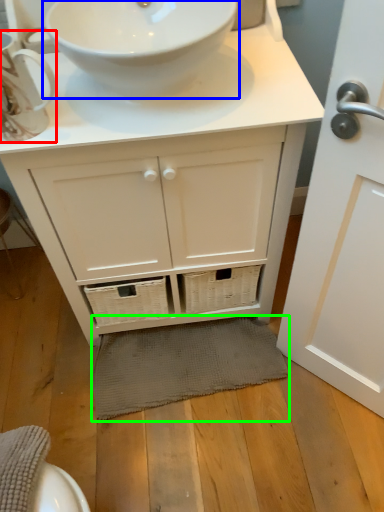
Question: Which object is the closest to the teacup (highlighted by a red box)? Choose among these: sink (highlighted by a blue box) or bath mat (highlighted by a green box).

Choices:
 (A) sink
 (B) bath mat

Answer: (A)